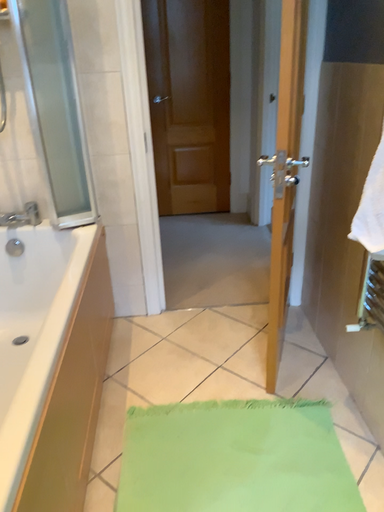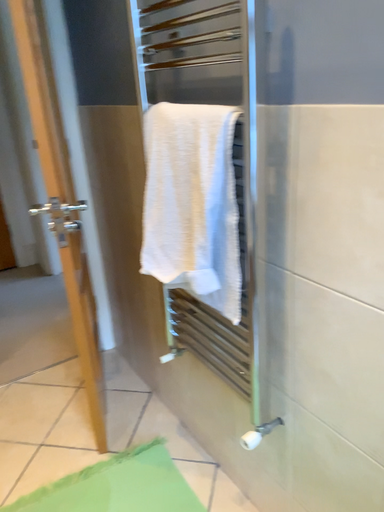
Question: How did the camera likely rotate when shooting the video?

Choices:
 (A) rotated upward
 (B) rotated downward

Answer: (A)